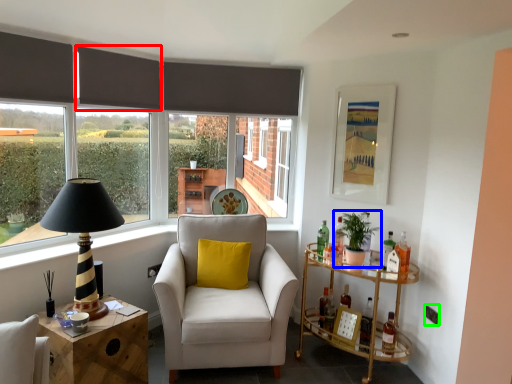
Question: Which object is positioned farthest from curtain (highlighted by a red box)? Select from houseplant (highlighted by a blue box) and power outlet (highlighted by a green box).

Choices:
 (A) houseplant
 (B) power outlet

Answer: (B)